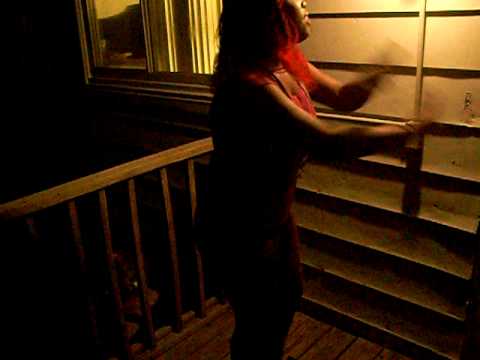
At what (x,y) coordinates should I click in order to perform the action: click on baluster. Please return your answer as a coordinate pair (x, y). The height and width of the screenshot is (360, 480). Looking at the image, I should click on (112, 261).